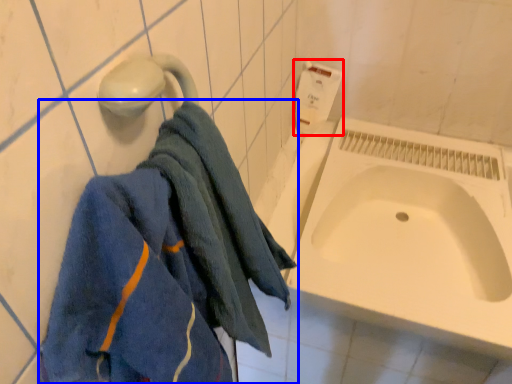
Question: Among these objects, which one is nearest to the camera, toilet paper (highlighted by a red box) or towel (highlighted by a blue box)?

Choices:
 (A) toilet paper
 (B) towel

Answer: (B)